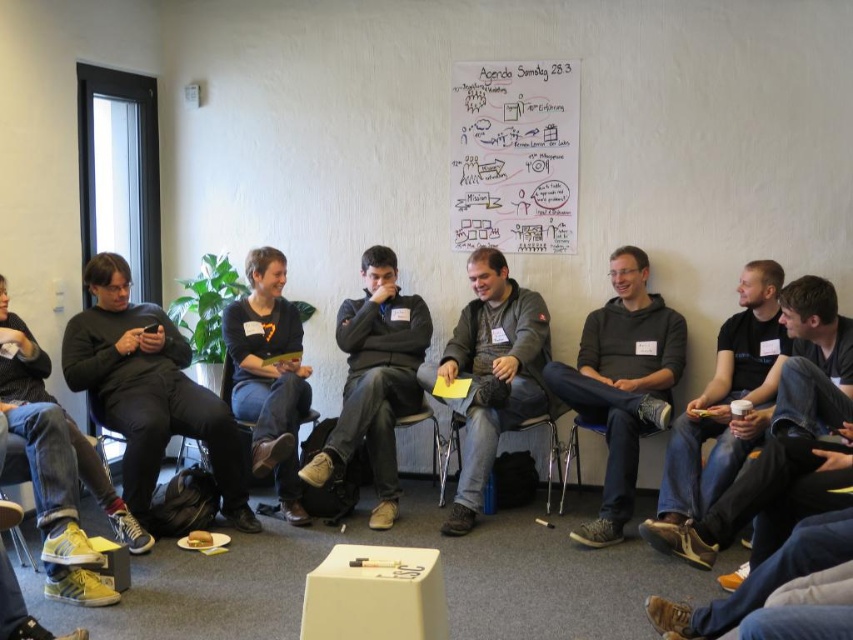
You are organizing a photo shoot and need to ensure that the dark gray sweater at center and the black matte shirt at center are visible in the frame. Based on their sizes, which clothing item should you focus the camera on to ensure both are in the shot without cropping?

The dark gray sweater at center has a larger size compared to the black matte shirt at center, so focusing the camera on the dark gray sweater at center would ensure both items are visible without cropping since it occupies more space in the frame.

You are a photographer standing at the back of the room. You want to take a photo of the black matte shirt at center and the yellow leather sneakers at lower left. Which object will appear smaller in the photo?

The yellow leather sneakers at lower left will appear smaller in the photo because it is not as tall as the black matte shirt at center.